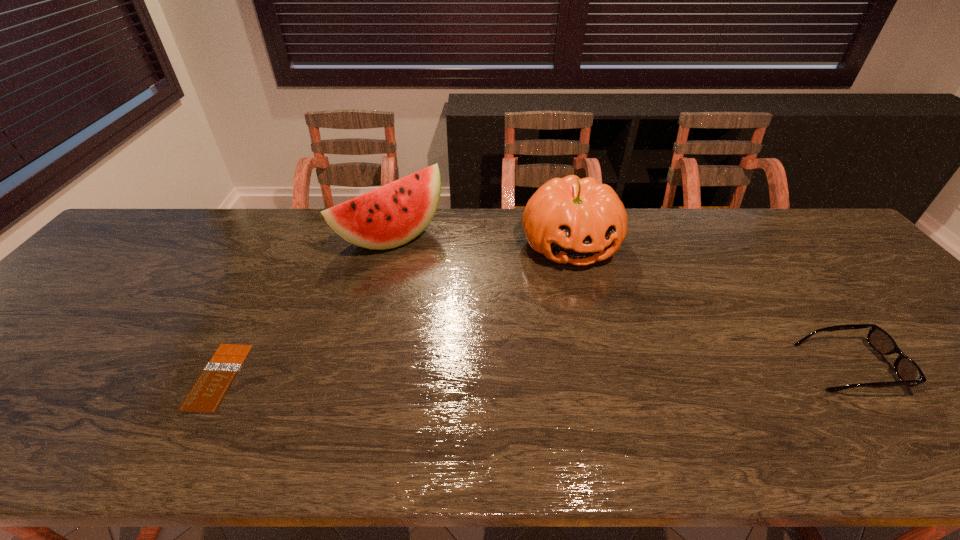
Where is `free space on the desktop that is between the leftmost object and the third tallest object and is positioned on the outer rind of the third object from right to left`? free space on the desktop that is between the leftmost object and the third tallest object and is positioned on the outer rind of the third object from right to left is located at coordinates (549, 372).

Locate an element on the screen. The height and width of the screenshot is (540, 960). free spot on the desktop that is between the shortest object and the second shortest object and is positioned on the carved face of the pumpkin is located at coordinates (621, 370).